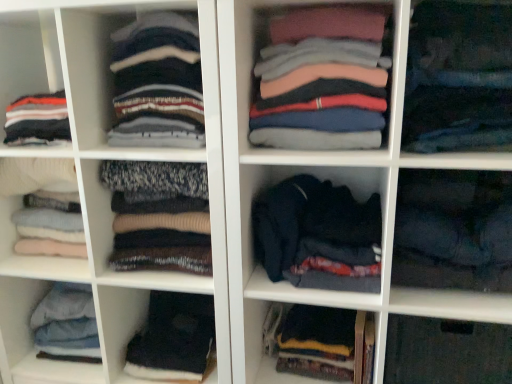
Question: Is knit sweater at center, acting as the seventh clothing starting from the right, outside black fabric at lower left, arranged as the sixth clothing when viewed from the right?

Choices:
 (A) no
 (B) yes

Answer: (B)

Question: Can you confirm if knit sweater at center, arranged as the 3th clothing when viewed from the left, is positioned to the right of black fabric at lower left, arranged as the sixth clothing when viewed from the right?

Choices:
 (A) no
 (B) yes

Answer: (A)

Question: Is knit sweater at center, acting as the seventh clothing starting from the right, looking in the opposite direction of black fabric at lower left, arranged as the sixth clothing when viewed from the right?

Choices:
 (A) yes
 (B) no

Answer: (B)

Question: Does knit sweater at center, arranged as the 3th clothing when viewed from the left, have a lesser height compared to black fabric at lower left, positioned as the fourth clothing in left-to-right order?

Choices:
 (A) no
 (B) yes

Answer: (A)

Question: From a real-world perspective, is knit sweater at center, acting as the seventh clothing starting from the right, on top of black fabric at lower left, arranged as the sixth clothing when viewed from the right?

Choices:
 (A) yes
 (B) no

Answer: (A)

Question: Can you confirm if knit sweater at center, arranged as the 3th clothing when viewed from the left, is positioned to the left of black fabric at lower left, arranged as the sixth clothing when viewed from the right?

Choices:
 (A) yes
 (B) no

Answer: (A)

Question: Does knit sweater at center, acting as the second clothing starting from the left, have a lesser width compared to dark blue fabric pants at center, which is counted as the eighth clothing, starting from the left?

Choices:
 (A) yes
 (B) no

Answer: (A)

Question: Is knit sweater at center, acting as the second clothing starting from the left, completely or partially outside of dark blue fabric pants at center, which is counted as the eighth clothing, starting from the left?

Choices:
 (A) yes
 (B) no

Answer: (A)

Question: From the image's perspective, is knit sweater at center, placed as the 8th clothing when sorted from right to left, located above dark blue fabric pants at center, which is counted as the eighth clothing, starting from the left?

Choices:
 (A) yes
 (B) no

Answer: (B)

Question: Does knit sweater at center, placed as the 8th clothing when sorted from right to left, have a larger size compared to dark blue fabric pants at center, which is counted as the eighth clothing, starting from the left?

Choices:
 (A) no
 (B) yes

Answer: (B)

Question: Is knit sweater at center, acting as the second clothing starting from the left, at the right side of dark blue fabric pants at center, the second clothing viewed from the right?

Choices:
 (A) no
 (B) yes

Answer: (A)

Question: Is knit sweater at center, placed as the 8th clothing when sorted from right to left, touching dark blue fabric pants at center, which is counted as the eighth clothing, starting from the left?

Choices:
 (A) yes
 (B) no

Answer: (B)

Question: Would you consider dark blue fabric at lower right, the first clothing when ordered from right to left, to be distant from dark blue sweater at center?

Choices:
 (A) yes
 (B) no

Answer: (B)